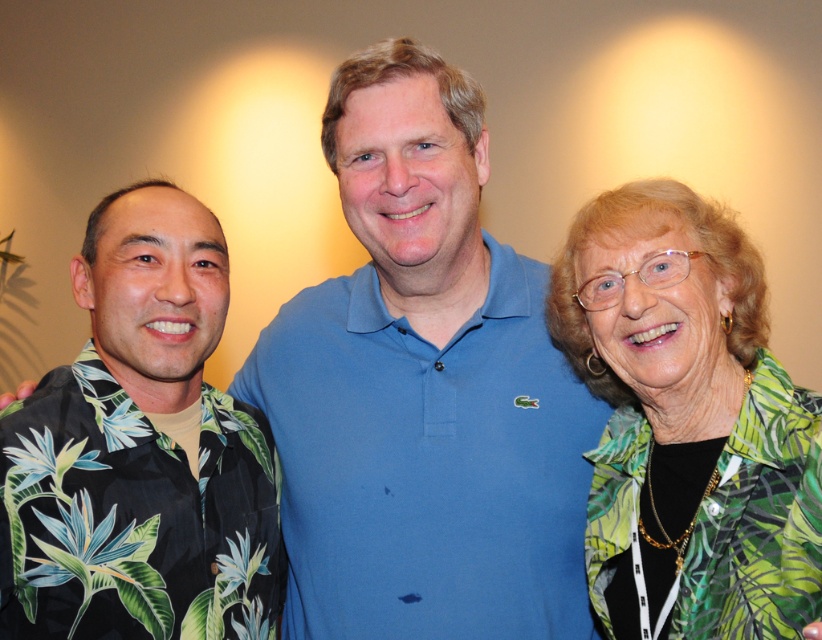
Question: From the image, what is the correct spatial relationship of black floral shirt at left in relation to green leafy blouse at right?

Choices:
 (A) left
 (B) right

Answer: (A)

Question: Is black floral shirt at left closer to camera compared to green leafy blouse at right?

Choices:
 (A) no
 (B) yes

Answer: (A)

Question: Which point is closer to the camera?

Choices:
 (A) (156, 541)
 (B) (619, 506)

Answer: (A)

Question: Which point is farther to the camera?

Choices:
 (A) (181, 458)
 (B) (726, 525)

Answer: (A)

Question: Does black floral shirt at left appear under green leafy blouse at right?

Choices:
 (A) no
 (B) yes

Answer: (B)